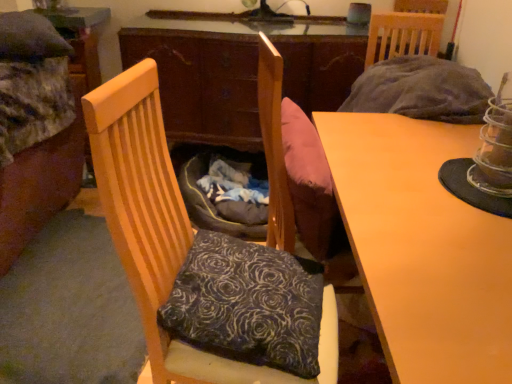
Question: Is wooden chair at left wider than matte wood desk at center?

Choices:
 (A) yes
 (B) no

Answer: (B)

Question: Could matte wood desk at center be considered to be inside wooden chair at left?

Choices:
 (A) no
 (B) yes

Answer: (A)

Question: Is wooden chair at left taller than matte wood desk at center?

Choices:
 (A) yes
 (B) no

Answer: (A)

Question: Considering the relative sizes of wooden chair at left and matte wood desk at center in the image provided, is wooden chair at left smaller than matte wood desk at center?

Choices:
 (A) yes
 (B) no

Answer: (A)

Question: From the image's perspective, is wooden chair at left located beneath matte wood desk at center?

Choices:
 (A) yes
 (B) no

Answer: (B)

Question: Is the depth of wooden chair at left greater than that of matte wood desk at center?

Choices:
 (A) no
 (B) yes

Answer: (B)

Question: From the image's perspective, is velvet floral pillow at center located beneath velvet fabric bed at left?

Choices:
 (A) no
 (B) yes

Answer: (B)

Question: Are velvet floral pillow at center and velvet fabric bed at left far apart?

Choices:
 (A) no
 (B) yes

Answer: (B)

Question: Does velvet floral pillow at center have a smaller size compared to velvet fabric bed at left?

Choices:
 (A) no
 (B) yes

Answer: (B)

Question: Does velvet floral pillow at center have a lesser height compared to velvet fabric bed at left?

Choices:
 (A) yes
 (B) no

Answer: (A)

Question: Is velvet floral pillow at center behind velvet fabric bed at left?

Choices:
 (A) yes
 (B) no

Answer: (B)

Question: Does velvet floral pillow at center have a greater height compared to velvet fabric bed at left?

Choices:
 (A) no
 (B) yes

Answer: (A)

Question: Would you say matte wood desk at center is outside velvet floral pillow at center?

Choices:
 (A) no
 (B) yes

Answer: (B)